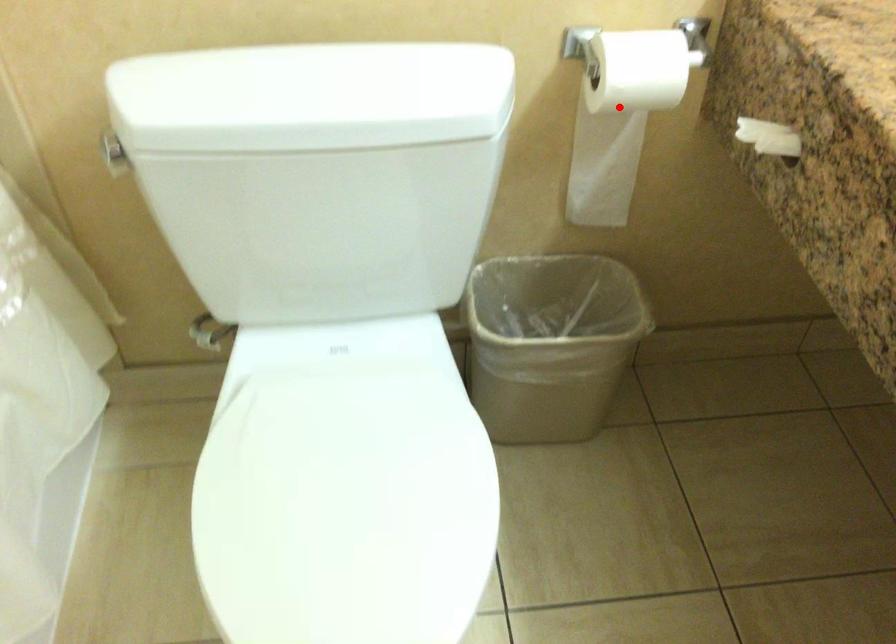
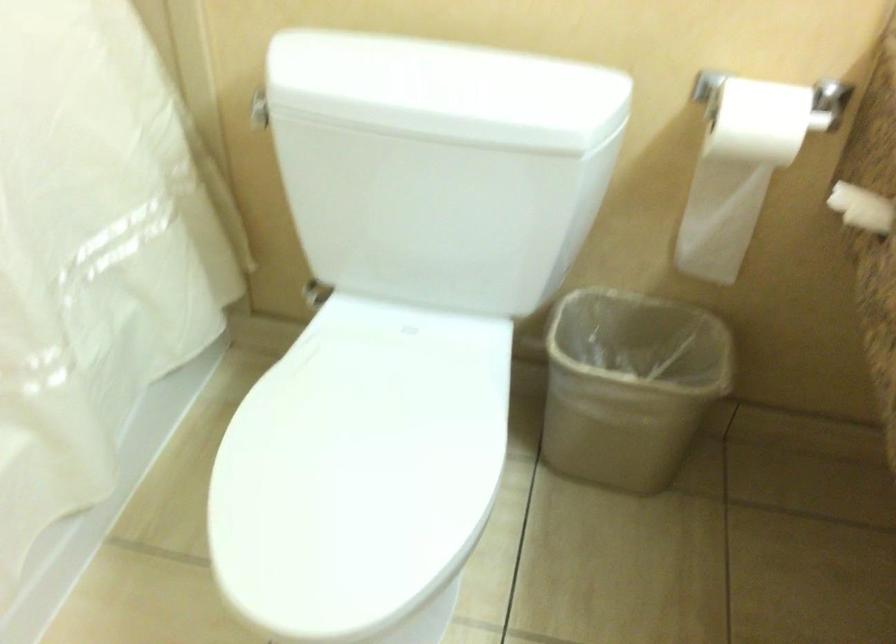
Where in the second image is the point corresponding to the highlighted location from the first image?

(744, 162)